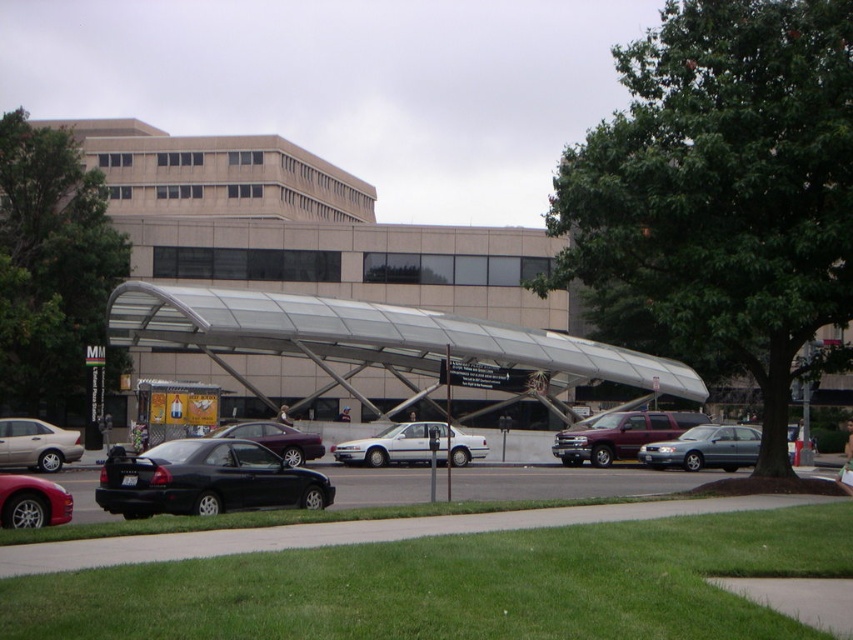
Question: Is matte black sedan at lower left to the left of metallic silver sedan at left from the viewer's perspective?

Choices:
 (A) yes
 (B) no

Answer: (B)

Question: Is metallic silver sedan at center positioned in front of shiny black sedan at center?

Choices:
 (A) no
 (B) yes

Answer: (B)

Question: Which object appears closest to the camera in this image?

Choices:
 (A) shiny black sedan at center
 (B) metallic silver suv at center
 (C) transparent glass bus stop at center
 (D) metallic silver sedan at center

Answer: (D)

Question: Which point is farther to the camera?

Choices:
 (A) metallic silver sedan at left
 (B) metallic silver sedan at center
 (C) transparent glass bus stop at center
 (D) metallic silver suv at center

Answer: (D)

Question: Which of the following is the closest to the observer?

Choices:
 (A) black car at lower left
 (B) metallic silver sedan at center
 (C) shiny black sedan at center
 (D) white matte sedan at center

Answer: (A)

Question: Is matte black sedan at lower left closer to the viewer compared to metallic silver suv at center?

Choices:
 (A) no
 (B) yes

Answer: (B)